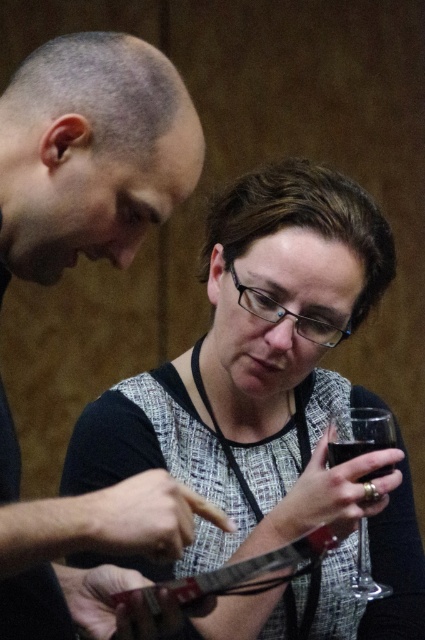
You are a photographer trying to capture the interaction between the two people. You want to ensure that both the matte black shirt at left and the clear glass at lower center are visible in your photo. Based on their positions, which object should you focus on first to ensure both are in frame?

The matte black shirt at left is located above the clear glass at lower center, so focusing on the clear glass at lower center first would allow you to frame the shot so both objects are visible.

Consider the image. You are a photographer trying to capture a candid shot of the scene. You want to frame the matte black shirt at left and the clear glass at lower center in the same shot. Which object should you position closer to the left edge of your camera frame?

The matte black shirt at left should be positioned closer to the left edge of your camera frame since it is already to the left of the clear glass at lower center.

What is the object located at the coordinates point (269, 412) in the image?

The point (269, 412) indicates a speckled fabric dress at center.